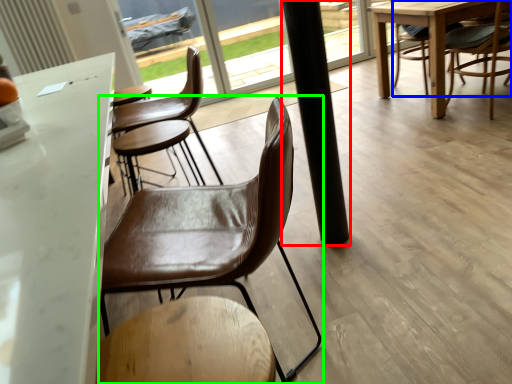
Question: Which object is positioned farthest from pillar (highlighted by a red box)? Select from chair (highlighted by a blue box) and chair (highlighted by a green box).

Choices:
 (A) chair
 (B) chair

Answer: (A)